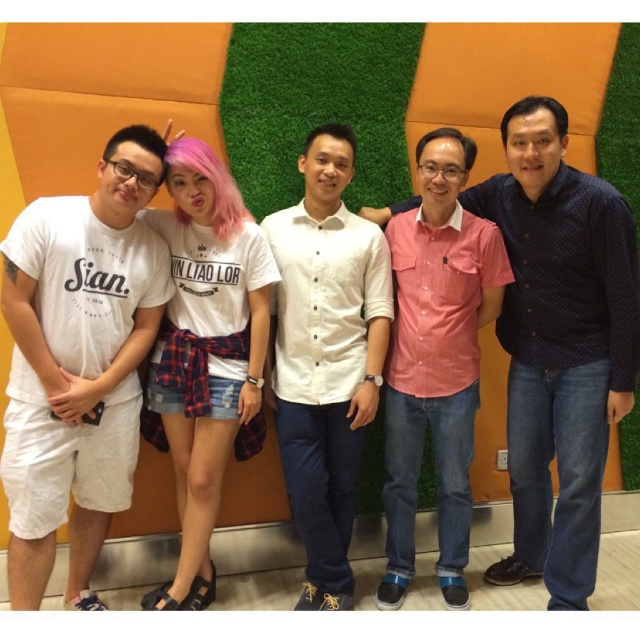
Which individual has black matte hair at upper right?

The individual with black matte hair at upper right is located at point (534,112).